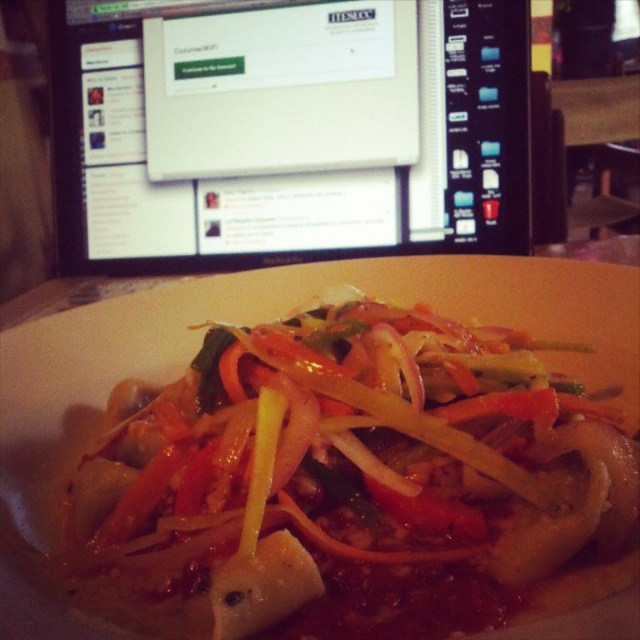
You are a food photographer aiming to capture a close shot of the slightly translucent pasta at center. If your camera requires the subject to be at least 15 inches away to focus properly, will you need to adjust your camera position?

The slightly translucent pasta at center is only 14.21 inches away from the camera, which is less than the required 15 inches for proper focus. Therefore, you need to move the camera farther away or adjust the focus settings to ensure clarity.

You are a chef looking at this image. You need to adjust the position of the slightly translucent pasta at center so that it is no longer directly under the black glossy monitor at upper center. Which direction should you move it?

The slightly translucent pasta at center is currently below the black glossy monitor at upper center. To move it away from being directly under the monitor, you should move it either to the left or right side away from the center, or upwards.

You are a photographer trying to capture both the slightly translucent pasta at center and the black glossy monitor at upper center in a single shot. Given that your camera has a maximum focus range of 34 inches, will you be able to capture both objects clearly in focus?

The slightly translucent pasta at center and black glossy monitor at upper center are 34.75 inches apart from each other. Since the distance between them exceeds the camera maximum focus range of 34 inches, the photographer will not be able to capture both objects clearly in focus.